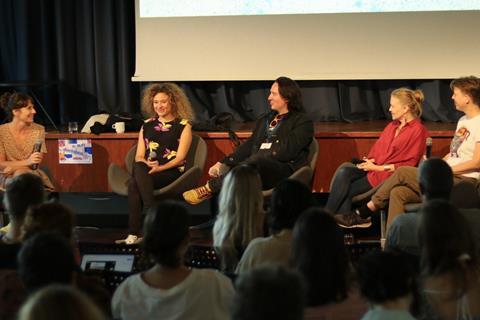
Where is `curtains`? The height and width of the screenshot is (320, 480). curtains is located at coordinates (80, 58).